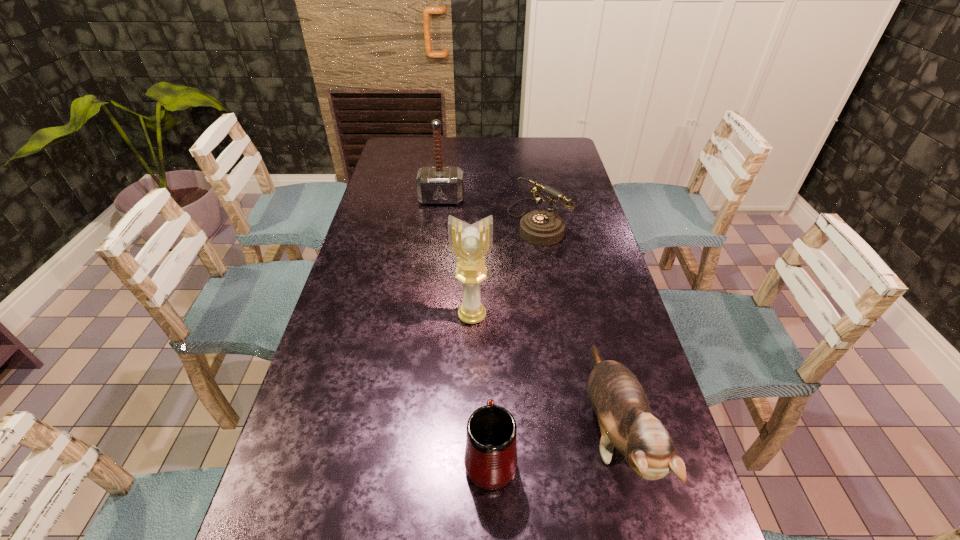
Where is `empty space between the award and the mug`? The image size is (960, 540). empty space between the award and the mug is located at coordinates 481,387.

Find the location of a particular element. This screenshot has height=540, width=960. free spot between the mug and the award is located at coordinates (481, 387).

What are the coordinates of `unoccupied position between the telephone and the cat` in the screenshot? It's located at (573, 325).

This screenshot has height=540, width=960. What are the coordinates of `empty space between the award and the mug` in the screenshot? It's located at (481, 387).

Where is `object that stands as the fourth closest to the mug`? object that stands as the fourth closest to the mug is located at coordinates (435, 185).

Locate which object ranks third in proximity to the mug. Please provide its 2D coordinates. Your answer should be formatted as a tuple, i.e. [(x, y)], where the tuple contains the x and y coordinates of a point satisfying the conditions above.

[(540, 227)]

Find the location of a particular element. free region that satisfies the following two spatial constraints: 1. on the side of the mug with the handle; 2. on the right side of the telephone is located at coordinates (486, 221).